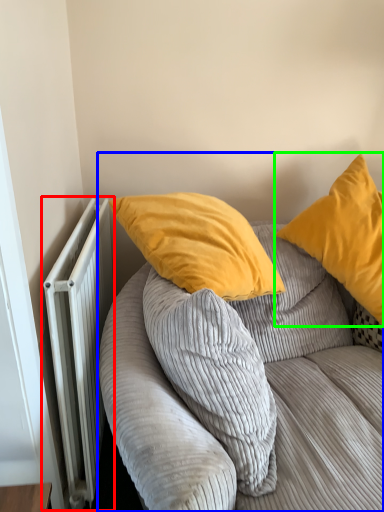
Question: Considering the real-world distances, which object is farthest from radiator (highlighted by a red box)? studio couch (highlighted by a blue box) or pillow (highlighted by a green box)?

Choices:
 (A) studio couch
 (B) pillow

Answer: (B)